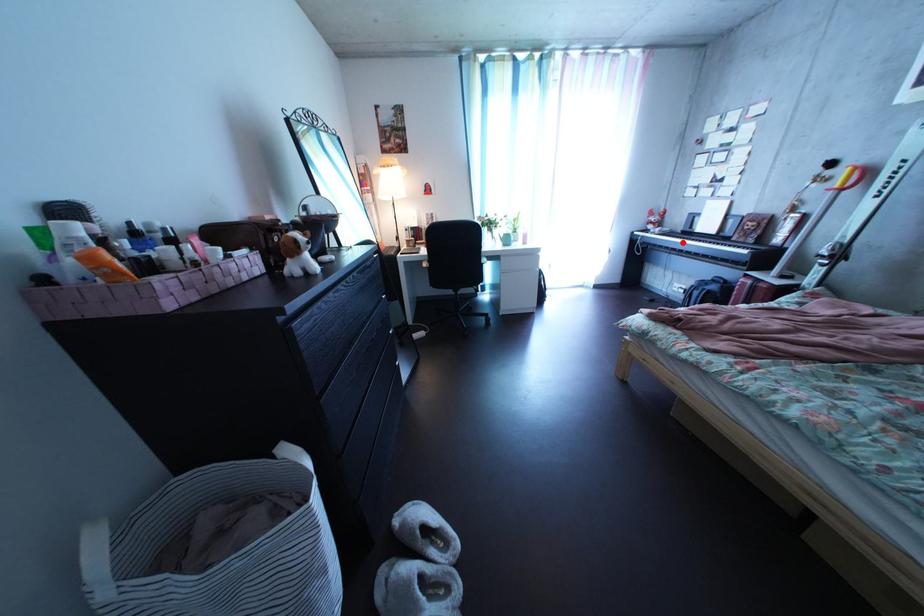
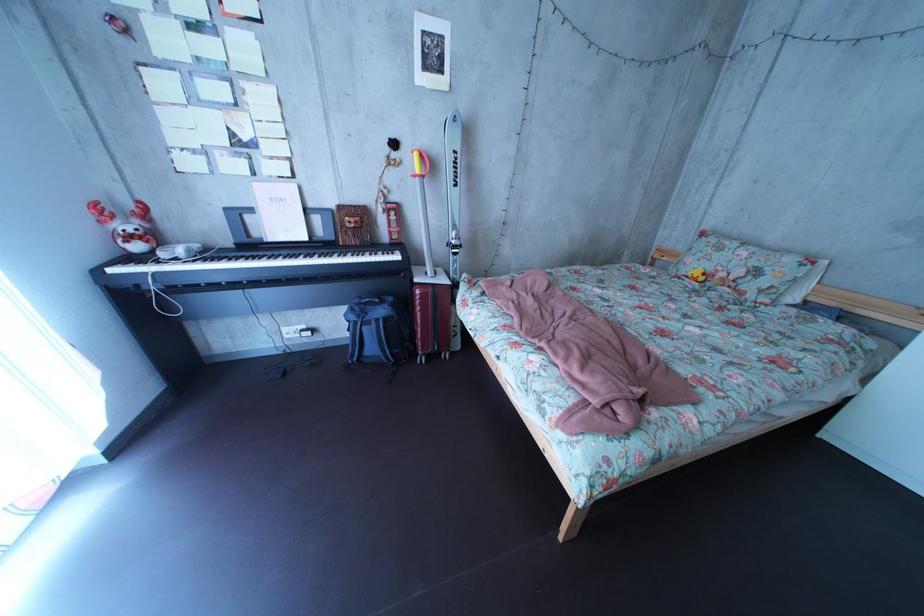
Locate, in the second image, the point that corresponds to the highlighted location in the first image.

(225, 262)